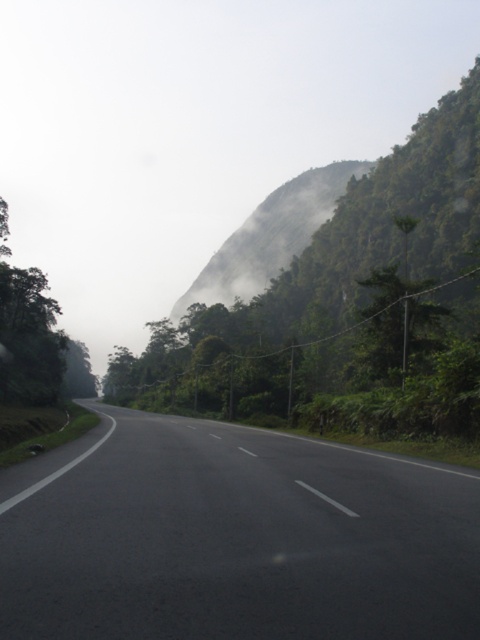
Question: Does black asphalt highway at center have a smaller size compared to green leafy tree at upper center?

Choices:
 (A) no
 (B) yes

Answer: (B)

Question: Which of these objects is positioned farthest from the green leafy tree at left?

Choices:
 (A) green leafy tree at upper center
 (B) black asphalt highway at center

Answer: (A)

Question: Can you confirm if black asphalt highway at center is positioned above green leafy tree at left?

Choices:
 (A) yes
 (B) no

Answer: (B)

Question: Which of the following is the closest to the observer?

Choices:
 (A) green leafy tree at upper center
 (B) black asphalt highway at center
 (C) green leafy tree at left
 (D) green leafy mountain at upper center

Answer: (B)

Question: Is green leafy mountain at upper center further to the viewer compared to green leafy tree at left?

Choices:
 (A) no
 (B) yes

Answer: (B)

Question: Which point is closer to the camera taking this photo?

Choices:
 (A) (303, 195)
 (B) (51, 360)
 (C) (374, 305)
 (D) (339, 570)

Answer: (D)